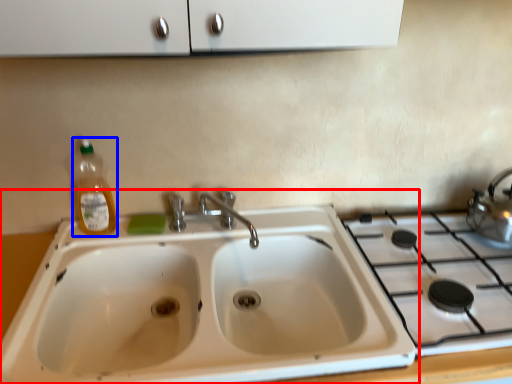
Question: Among these objects, which one is farthest to the camera, sink (highlighted by a red box) or bottle (highlighted by a blue box)?

Choices:
 (A) sink
 (B) bottle

Answer: (B)